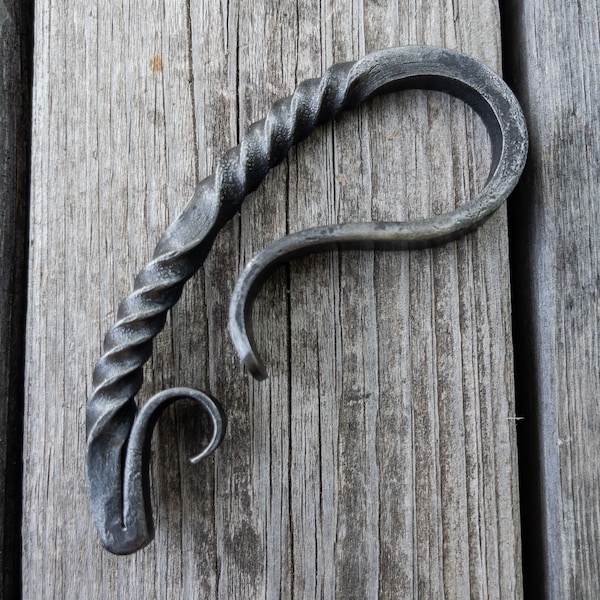
Locate an element on the screen. metal hook is located at coordinates (390, 67).